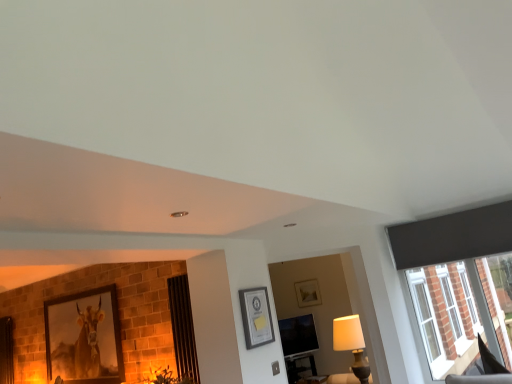
Question: From a real-world perspective, is white fabric lampshade at lower right below matte black picture frame at center, which appears as the first picture frame when viewed from the front?

Choices:
 (A) yes
 (B) no

Answer: (A)

Question: Can you confirm if white fabric lampshade at lower right is shorter than matte black picture frame at center, which appears as the first picture frame when viewed from the front?

Choices:
 (A) yes
 (B) no

Answer: (B)

Question: Does white fabric lampshade at lower right have a greater height compared to matte black picture frame at center, placed as the 1th picture frame when sorted from top to bottom?

Choices:
 (A) yes
 (B) no

Answer: (A)

Question: Is white fabric lampshade at lower right facing away from matte black picture frame at center, which is the first picture frame from right to left?

Choices:
 (A) no
 (B) yes

Answer: (A)

Question: Considering the relative sizes of white fabric lampshade at lower right and matte black picture frame at center, which is the first picture frame from right to left, in the image provided, is white fabric lampshade at lower right smaller than matte black picture frame at center, which is the first picture frame from right to left,?

Choices:
 (A) no
 (B) yes

Answer: (A)

Question: From the image's perspective, is matte black picture frame at center, placed as the 1th picture frame when sorted from top to bottom, above or below white fabric lampshade at lower right?

Choices:
 (A) above
 (B) below

Answer: (A)

Question: Looking at their shapes, would you say matte black picture frame at center, which is the second picture frame in bottom-to-top order, is wider or thinner than white fabric lampshade at lower right?

Choices:
 (A) thin
 (B) wide

Answer: (A)

Question: From a real-world perspective, is matte black picture frame at center, which is the second picture frame in bottom-to-top order, physically located above or below white fabric lampshade at lower right?

Choices:
 (A) below
 (B) above

Answer: (B)

Question: Do you think matte black picture frame at center, which is the first picture frame from right to left, is within white fabric lampshade at lower right, or outside of it?

Choices:
 (A) inside
 (B) outside

Answer: (B)

Question: From a real-world perspective, is black leather swivel chair at lower right physically located above or below matte black picture frame at center, the 2th picture frame viewed from the back?

Choices:
 (A) below
 (B) above

Answer: (A)

Question: In terms of width, does black leather swivel chair at lower right look wider or thinner when compared to matte black picture frame at center, placed as the 1th picture frame when sorted from top to bottom?

Choices:
 (A) thin
 (B) wide

Answer: (B)

Question: Considering their positions, is black leather swivel chair at lower right located in front of or behind matte black picture frame at center, placed as the 1th picture frame when sorted from top to bottom?

Choices:
 (A) front
 (B) behind

Answer: (B)

Question: Do you think black leather swivel chair at lower right is within matte black picture frame at center, which is the first picture frame from right to left, or outside of it?

Choices:
 (A) inside
 (B) outside

Answer: (B)

Question: Is matte black screen at center bigger or smaller than matte black picture frame at center, placed as the second picture frame when sorted from left to right?

Choices:
 (A) big
 (B) small

Answer: (A)

Question: Considering the positions of point (292, 345) and point (245, 332), is point (292, 345) closer or farther from the camera than point (245, 332)?

Choices:
 (A) farther
 (B) closer

Answer: (A)